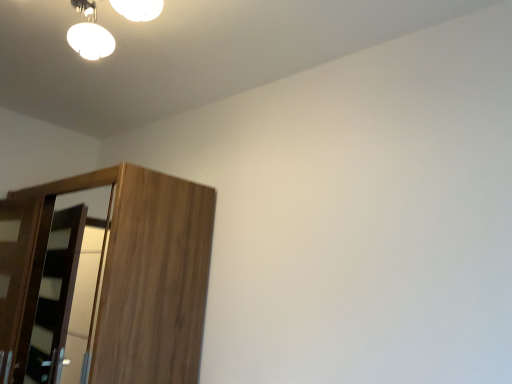
Describe the element at coordinates (136, 272) in the screenshot. The height and width of the screenshot is (384, 512). I see `wooden dresser at left` at that location.

In order to face wooden dresser at left, should I rotate leftwards or rightwards?

It's best to rotate left around 20.904 degrees.

The height and width of the screenshot is (384, 512). Identify the location of wooden dresser at left. (136, 272).

Locate an element on the screen. This screenshot has height=384, width=512. wooden dresser at left is located at coordinates (136, 272).